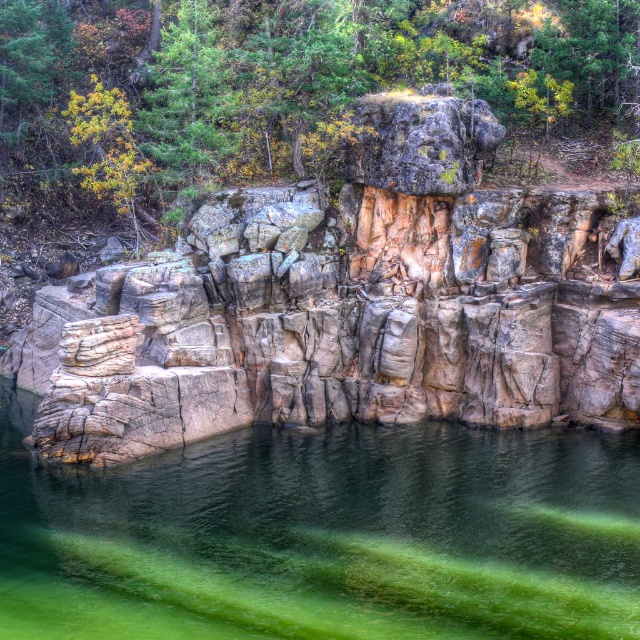
Question: Does green translucent water at center appear under green leafy tree at upper center?

Choices:
 (A) yes
 (B) no

Answer: (A)

Question: Considering the real-world distances, which object is closest to the rustic stone cliff at center?

Choices:
 (A) green translucent water at center
 (B) green leafy tree at upper center

Answer: (A)

Question: Where is rustic stone cliff at center located in relation to green leafy tree at upper center in the image?

Choices:
 (A) right
 (B) left

Answer: (A)

Question: Which of the following is the farthest from the observer?

Choices:
 (A) (477, 170)
 (B) (611, 26)
 (C) (284, 548)

Answer: (B)

Question: Does green translucent water at center appear under green leafy tree at upper center?

Choices:
 (A) yes
 (B) no

Answer: (A)

Question: Which object is positioned farthest from the green leafy tree at upper center?

Choices:
 (A) rustic stone cliff at center
 (B) green translucent water at center

Answer: (B)